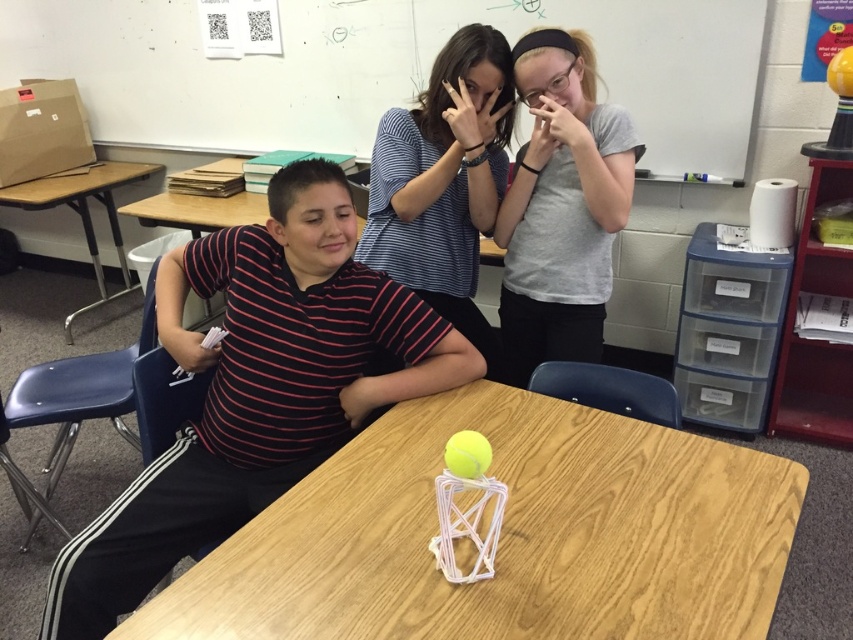
Question: Is wooden table at center below gray matte shirt at upper center?

Choices:
 (A) yes
 (B) no

Answer: (A)

Question: Is striped cotton shirt at left to the right of gray matte shirt at upper center from the viewer's perspective?

Choices:
 (A) no
 (B) yes

Answer: (A)

Question: Is striped cotton shirt at left thinner than blue striped shirt at upper center?

Choices:
 (A) no
 (B) yes

Answer: (A)

Question: Which point appears closest to the camera in this image?

Choices:
 (A) (462, 124)
 (B) (305, 301)
 (C) (682, 472)

Answer: (C)

Question: Which object is the farthest from the blue striped shirt at upper center?

Choices:
 (A) wooden table at center
 (B) brown wood table at left
 (C) gray matte shirt at upper center

Answer: (B)

Question: Which of these objects is positioned closest to the striped cotton shirt at left?

Choices:
 (A) brown wood table at left
 (B) gray matte shirt at upper center
 (C) blue striped shirt at upper center

Answer: (C)